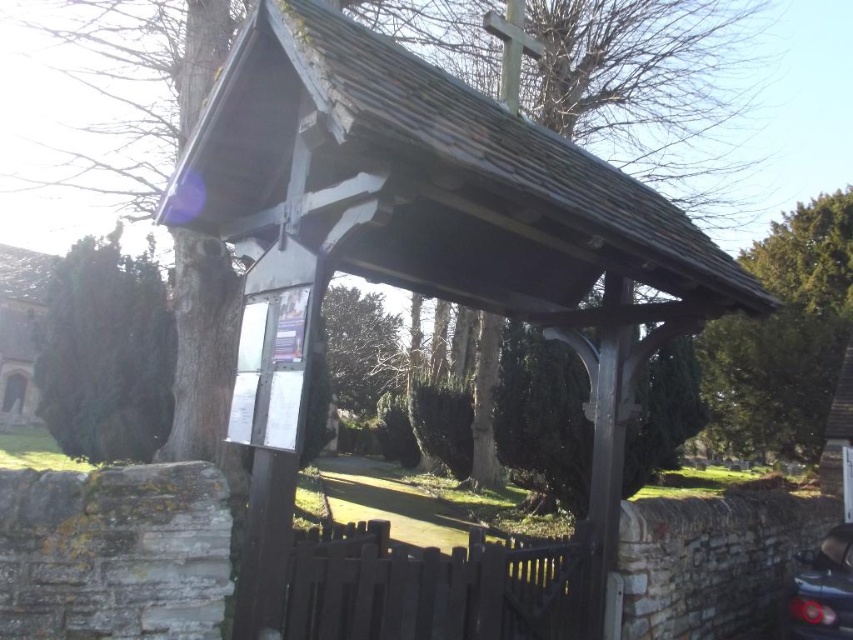
Is green leafy tree at upper right positioned behind shiny black car at lower right?

Yes, green leafy tree at upper right is further from the viewer.

Measure the distance between point (799, 387) and camera.

15.57 meters

The height and width of the screenshot is (640, 853). Find the location of `green leafy tree at upper right`. green leafy tree at upper right is located at coordinates (784, 337).

This screenshot has width=853, height=640. Find the location of `green leafy tree at upper right`. green leafy tree at upper right is located at coordinates (784, 337).

Consider the image. Is brown wooden gate at center below green leafy tree at center?

Yes, brown wooden gate at center is below green leafy tree at center.

Which is behind, point (311, 538) or point (357, 312)?

Positioned behind is point (357, 312).

The image size is (853, 640). In order to click on brown wooden gate at center in this screenshot , I will do `click(436, 586)`.

Describe the element at coordinates (106, 353) in the screenshot. I see `green textured hedge at left` at that location.

Who is more forward, (131, 285) or (849, 536)?

Positioned in front is point (849, 536).

Find the location of a particular element. green textured hedge at left is located at coordinates (106, 353).